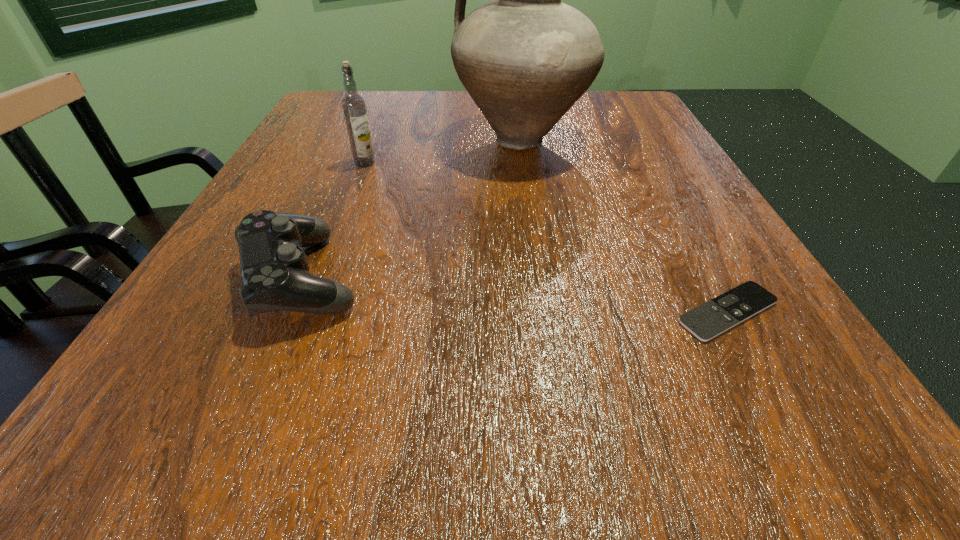
Where is `empty space between the remote control and the vodka`? The image size is (960, 540). empty space between the remote control and the vodka is located at coordinates (546, 237).

You are a GUI agent. You are given a task and a screenshot of the screen. Output one action in this format:
    pyautogui.click(x=<x>, y=<y>)
    Task: Click on the free space between the shortest object and the vodka
    The width and height of the screenshot is (960, 540).
    Given the screenshot: What is the action you would take?
    pyautogui.click(x=546, y=237)

Where is `the closest object to the control`? Image resolution: width=960 pixels, height=540 pixels. the closest object to the control is located at coordinates (354, 108).

Identify the location of object that is the third closest to the pitcher. (712, 318).

Where is `free point that satisfies the following two spatial constraints: 1. on the handle side of the pitcher; 2. on the label of the vodka`? This screenshot has height=540, width=960. free point that satisfies the following two spatial constraints: 1. on the handle side of the pitcher; 2. on the label of the vodka is located at coordinates (524, 163).

This screenshot has width=960, height=540. What are the coordinates of `vacant area in the image that satisfies the following two spatial constraints: 1. on the label of the second tallest object; 2. on the left side of the rightmost object` in the screenshot? It's located at (307, 312).

You are a GUI agent. You are given a task and a screenshot of the screen. Output one action in this format:
    pyautogui.click(x=<x>, y=<y>)
    Task: Click on the free space that satisfies the following two spatial constraints: 1. on the handle side of the third object from left to right; 2. on the label of the vodka
    The image size is (960, 540).
    Given the screenshot: What is the action you would take?
    pyautogui.click(x=524, y=163)

This screenshot has width=960, height=540. I want to click on free spot that satisfies the following two spatial constraints: 1. on the handle side of the pitcher; 2. on the right side of the rightmost object, so click(x=546, y=312).

Locate an element on the screen. The height and width of the screenshot is (540, 960). vacant space that satisfies the following two spatial constraints: 1. on the front side of the control; 2. on the left side of the shortest object is located at coordinates 287,312.

At what (x,y) coordinates should I click in order to perform the action: click on free space that satisfies the following two spatial constraints: 1. on the handle side of the pitcher; 2. on the label of the vodka. Please return your answer as a coordinate pair (x, y). The width and height of the screenshot is (960, 540). Looking at the image, I should click on (524, 163).